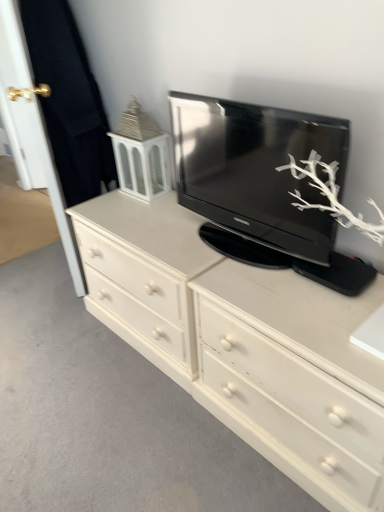
This screenshot has height=512, width=384. Identify the location of free spot below gold metallic door handle at upper left, the first door when ordered from left to right (from a real-world perspective). (38, 196).